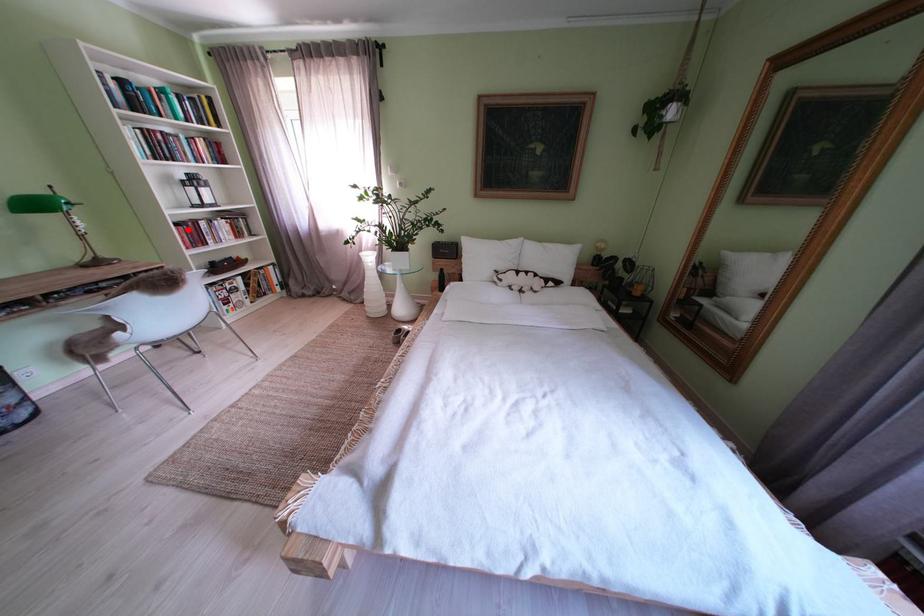
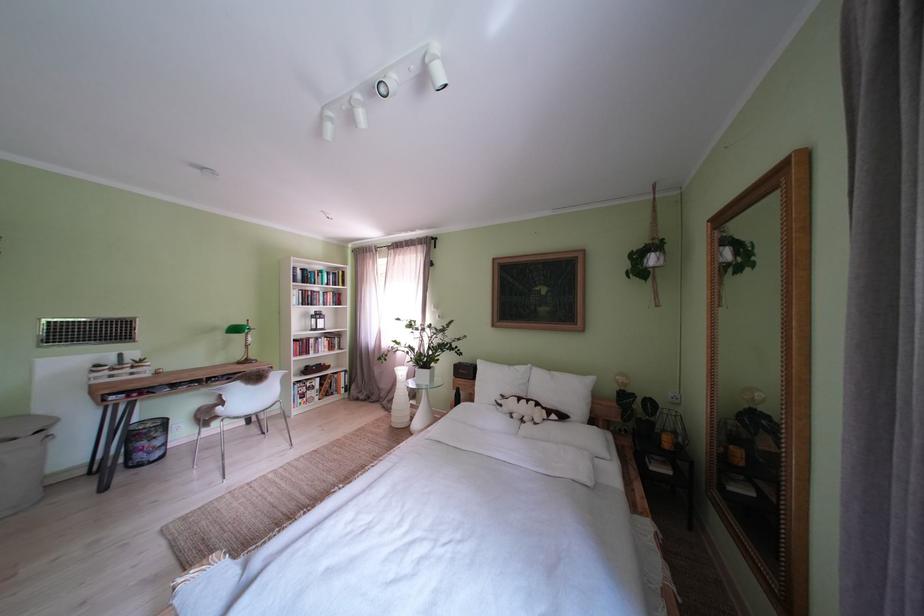
The point at the highlighted location is marked in the first image. Where is the corresponding point in the second image?

(307, 346)